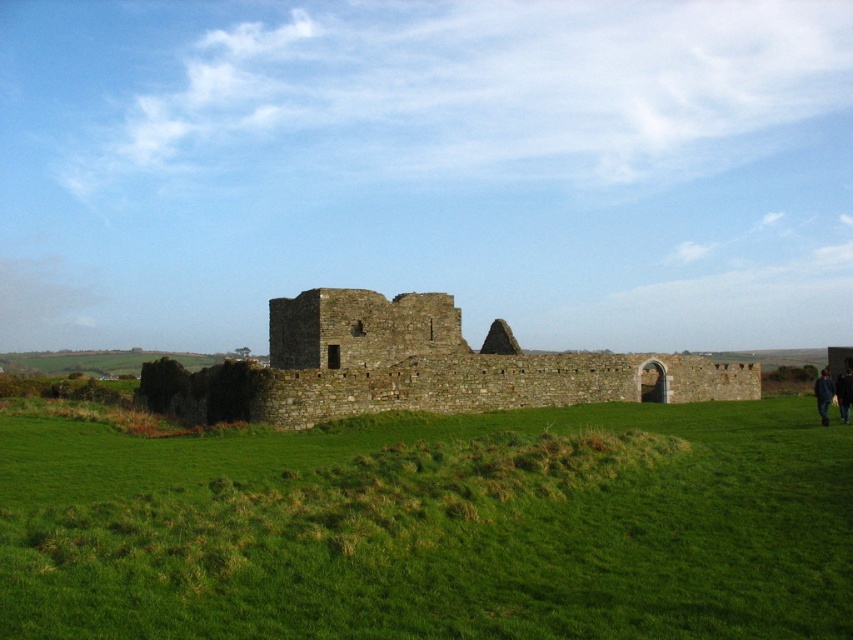
Question: Which of the following is the closest to the observer?

Choices:
 (A) dark blue jacket at lower right
 (B) green grassy hill at center
 (C) brown stone ruins at center

Answer: (B)

Question: Is dark blue jacket at lower right positioned at the back of dark blue fabric at lower right?

Choices:
 (A) yes
 (B) no

Answer: (B)

Question: Is green grassy hill at center smaller than dark blue jacket at lower right?

Choices:
 (A) no
 (B) yes

Answer: (B)

Question: Which point appears closest to the camera in this image?

Choices:
 (A) (769, 413)
 (B) (825, 412)

Answer: (B)

Question: Which of these objects is positioned farthest from the green grassy hill at center?

Choices:
 (A) dark blue fabric at lower right
 (B) dark blue jacket at lower right
 (C) brown stone ruins at center

Answer: (A)

Question: Is green grassy hill at center positioned before dark blue fabric at lower right?

Choices:
 (A) yes
 (B) no

Answer: (A)